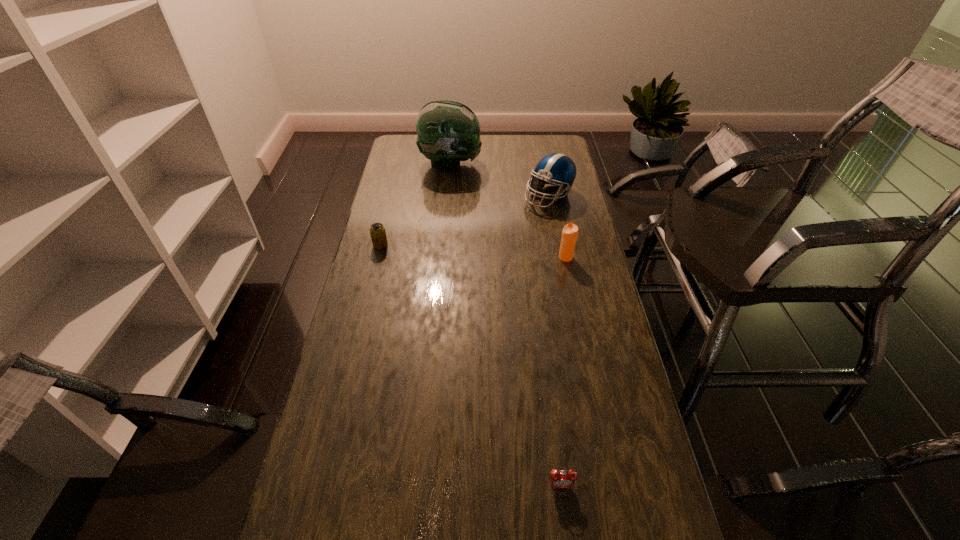
At what (x,y) coordinates should I click in order to perform the action: click on free space that satisfies the following two spatial constraints: 1. on the visor of the candle; 2. on the left side of the farthest object. Please return your answer as a coordinate pair (x, y). The image size is (960, 540). Looking at the image, I should click on (442, 258).

Find the location of a particular element. blank area in the image that satisfies the following two spatial constraints: 1. at the front of the right football helmet with the faceguard; 2. on the left side of the candle is located at coordinates point(561,258).